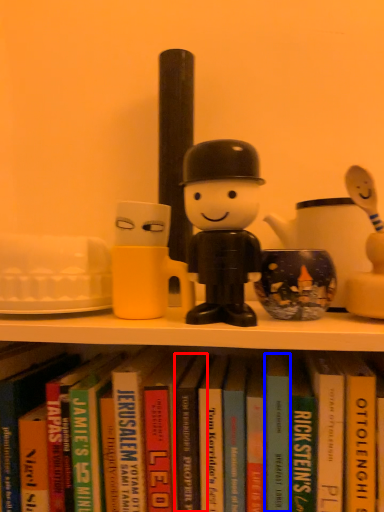
Question: Which point is further to the camera, paperback book (highlighted by a red box) or paperback book (highlighted by a blue box)?

Choices:
 (A) paperback book
 (B) paperback book

Answer: (A)